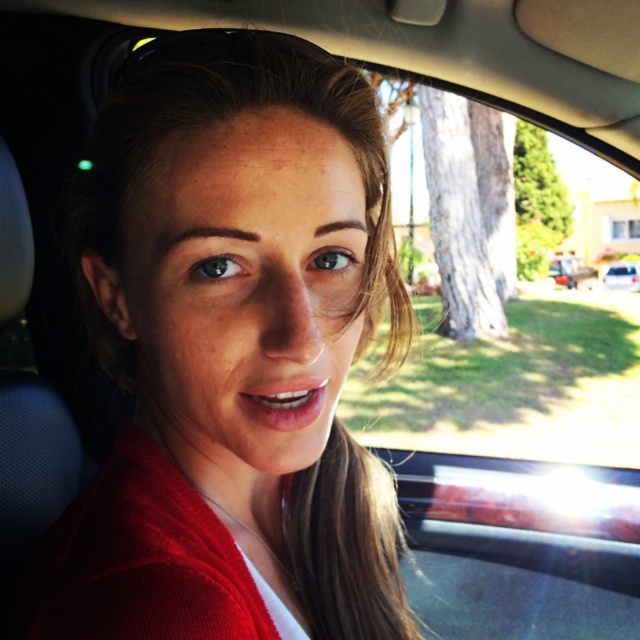
Question: Based on their relative distances, which object is nearer to the white glossy car at lower right?

Choices:
 (A) metallic silver car at right
 (B) matte red sweater at center

Answer: (A)

Question: Which of the following is the farthest from the observer?

Choices:
 (A) (122, 289)
 (B) (563, 284)

Answer: (B)

Question: Does matte red sweater at center have a larger size compared to metallic silver car at right?

Choices:
 (A) yes
 (B) no

Answer: (A)

Question: Considering the relative positions of matte red sweater at center and metallic silver car at right in the image provided, where is matte red sweater at center located with respect to metallic silver car at right?

Choices:
 (A) left
 (B) right

Answer: (A)

Question: Considering the real-world distances, which object is farthest from the white glossy car at lower right?

Choices:
 (A) metallic silver car at right
 (B) matte red sweater at center

Answer: (B)

Question: Can you confirm if matte red sweater at center is smaller than metallic silver car at right?

Choices:
 (A) no
 (B) yes

Answer: (A)